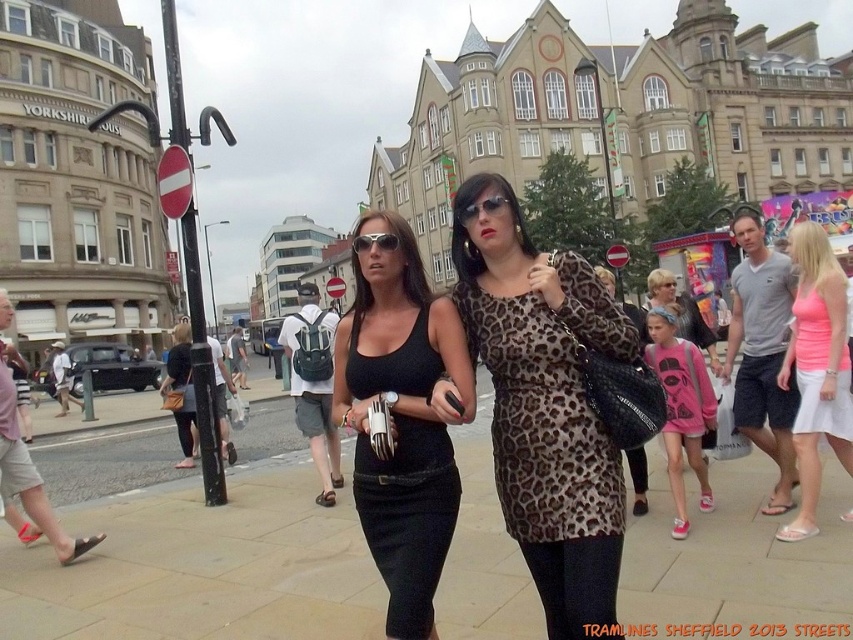
You are a photographer trying to capture both the leopard print dress at center and the pink satin dress at center in the same frame. Given their sizes, which dress might require you to step back to include its full width in the photo?

The leopard print dress at center has a larger width than the pink satin dress at center, so you might need to step back to include the full width of the leopard print dress at center in the photo.

You are standing at the point with coordinates point (498, 193) and want to move towards the point with coordinates point (364, 237). Which direction should you move to get closer to your destination?

You should move upwards because point (498, 193) is closer to the camera than point (364, 237), meaning the destination is further away from the camera. Moving upwards would take you toward the destination.